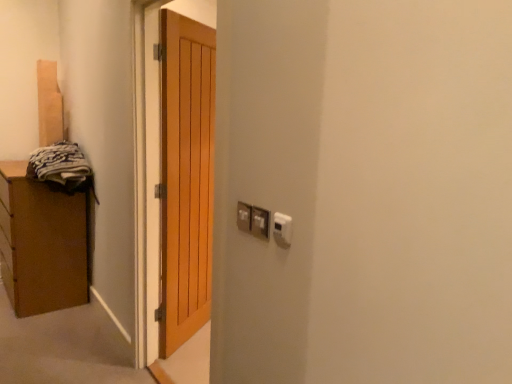
Where is `white plastic electric outlet at center, which is counted as the 3th electric outlet, starting from the front`? The height and width of the screenshot is (384, 512). white plastic electric outlet at center, which is counted as the 3th electric outlet, starting from the front is located at coordinates (x=244, y=216).

How different are the orientations of dark gray fabric at left and light brown wooden door at center in degrees?

The facing directions of dark gray fabric at left and light brown wooden door at center are 122 degrees apart.

Is dark gray fabric at left positioned beyond the bounds of light brown wooden door at center?

Indeed, dark gray fabric at left is completely outside light brown wooden door at center.

Based on the photo, is dark gray fabric at left turned away from light brown wooden door at center?

No, dark gray fabric at left's orientation is not away from light brown wooden door at center.

Between dark gray fabric at left and light brown wooden door at center, which one has less height?

Standing shorter between the two is dark gray fabric at left.

Considering the sizes of objects metallic silver electrical outlet at center-right, which is the 2th electric outlet from back to front, and white plastic thermostat at upper right, which is counted as the third electric outlet, starting from the back, in the image provided, who is wider, metallic silver electrical outlet at center-right, which is the 2th electric outlet from back to front, or white plastic thermostat at upper right, which is counted as the third electric outlet, starting from the back,?

metallic silver electrical outlet at center-right, which is the 2th electric outlet from back to front.

Locate an element on the screen. This screenshot has height=384, width=512. electric outlet that appears below the metallic silver electrical outlet at center-right, which is the 2th electric outlet from back to front (from the image's perspective) is located at coordinates pos(282,229).

Is metallic silver electrical outlet at center-right, positioned as the 2th electric outlet in front-to-back order, bigger or smaller than white plastic thermostat at upper right, which is counted as the third electric outlet, starting from the back?

In the image, metallic silver electrical outlet at center-right, positioned as the 2th electric outlet in front-to-back order, appears to be larger than white plastic thermostat at upper right, which is counted as the third electric outlet, starting from the back.

Is metallic silver electrical outlet at center-right, which is the 2th electric outlet from back to front, aimed at white plastic thermostat at upper right, which is counted as the third electric outlet, starting from the back?

No, metallic silver electrical outlet at center-right, which is the 2th electric outlet from back to front, does not turn towards white plastic thermostat at upper right, which is counted as the third electric outlet, starting from the back.

Is white plastic thermostat at upper right, which is counted as the third electric outlet, starting from the back, taller or shorter than metallic silver electrical outlet at center-right, which is the 2th electric outlet from back to front?

Considering their sizes, white plastic thermostat at upper right, which is counted as the third electric outlet, starting from the back, has more height than metallic silver electrical outlet at center-right, which is the 2th electric outlet from back to front.

From a real-world perspective, which object rests below the other?

From a 3D spatial view, white plastic thermostat at upper right, which is counted as the third electric outlet, starting from the back, is below.

Is white plastic thermostat at upper right, which is counted as the third electric outlet, starting from the back, positioned in front of metallic silver electrical outlet at center-right, which is the 2th electric outlet from back to front?

Yes, it is.

Considering the sizes of objects white plastic thermostat at upper right, marked as the first electric outlet in a front-to-back arrangement, and metallic silver electrical outlet at center-right, which is the 2th electric outlet from back to front, in the image provided, who is smaller, white plastic thermostat at upper right, marked as the first electric outlet in a front-to-back arrangement, or metallic silver electrical outlet at center-right, which is the 2th electric outlet from back to front,?

With smaller size is white plastic thermostat at upper right, marked as the first electric outlet in a front-to-back arrangement.

Is white plastic thermostat at upper right, which is counted as the third electric outlet, starting from the back, located outside dark gray fabric at left?

Indeed, white plastic thermostat at upper right, which is counted as the third electric outlet, starting from the back, is completely outside dark gray fabric at left.

From their relative heights in the image, would you say white plastic thermostat at upper right, marked as the first electric outlet in a front-to-back arrangement, is taller or shorter than dark gray fabric at left?

Clearly, white plastic thermostat at upper right, marked as the first electric outlet in a front-to-back arrangement, is shorter compared to dark gray fabric at left.

From a real-world perspective, is white plastic thermostat at upper right, marked as the first electric outlet in a front-to-back arrangement, positioned over dark gray fabric at left based on gravity?

Indeed, from a real-world perspective, white plastic thermostat at upper right, marked as the first electric outlet in a front-to-back arrangement, stands above dark gray fabric at left.

Consider the image. Could you tell me if white plastic thermostat at upper right, which is counted as the third electric outlet, starting from the back, is facing dark gray fabric at left?

No, white plastic thermostat at upper right, which is counted as the third electric outlet, starting from the back, is not aimed at dark gray fabric at left.

Is dark gray fabric at left taller or shorter than white plastic electric outlet at center, which appears as the first electric outlet when viewed from the back?

dark gray fabric at left is taller than white plastic electric outlet at center, which appears as the first electric outlet when viewed from the back.

From a real-world perspective, is dark gray fabric at left on white plastic electric outlet at center, which appears as the first electric outlet when viewed from the back?

No, from a real-world perspective, dark gray fabric at left is not on top of white plastic electric outlet at center, which appears as the first electric outlet when viewed from the back.

Between dark gray fabric at left and white plastic electric outlet at center, which appears as the first electric outlet when viewed from the back, which one is positioned in front?

white plastic electric outlet at center, which appears as the first electric outlet when viewed from the back, is in front.

Is dark gray fabric at left not close to white plastic electric outlet at center, which appears as the first electric outlet when viewed from the back?

Absolutely, dark gray fabric at left is distant from white plastic electric outlet at center, which appears as the first electric outlet when viewed from the back.

Is white plastic electric outlet at center, which appears as the first electric outlet when viewed from the back, taller or shorter than metallic silver electrical outlet at center-right, which is the 2th electric outlet from back to front?

Considering their sizes, white plastic electric outlet at center, which appears as the first electric outlet when viewed from the back, has less height than metallic silver electrical outlet at center-right, which is the 2th electric outlet from back to front.

Considering the relative positions of white plastic electric outlet at center, which appears as the first electric outlet when viewed from the back, and metallic silver electrical outlet at center-right, positioned as the 2th electric outlet in front-to-back order, in the image provided, is white plastic electric outlet at center, which appears as the first electric outlet when viewed from the back, to the left of metallic silver electrical outlet at center-right, positioned as the 2th electric outlet in front-to-back order, from the viewer's perspective?

Yes.

How many degrees apart are the facing directions of white plastic electric outlet at center, which is counted as the 3th electric outlet, starting from the front, and metallic silver electrical outlet at center-right, positioned as the 2th electric outlet in front-to-back order?

3.08 degrees separate the facing orientations of white plastic electric outlet at center, which is counted as the 3th electric outlet, starting from the front, and metallic silver electrical outlet at center-right, positioned as the 2th electric outlet in front-to-back order.

From the image's perspective, between white plastic electric outlet at center, which is counted as the 3th electric outlet, starting from the front, and metallic silver electrical outlet at center-right, positioned as the 2th electric outlet in front-to-back order, which one is located above?

white plastic electric outlet at center, which is counted as the 3th electric outlet, starting from the front.

Is white plastic electric outlet at center, which appears as the first electric outlet when viewed from the back, turned away from light brown wooden door at center?

No.

From the picture: How many degrees apart are the facing directions of white plastic electric outlet at center, which is counted as the 3th electric outlet, starting from the front, and light brown wooden door at center?

124 degrees.

Considering the positions of objects white plastic electric outlet at center, which appears as the first electric outlet when viewed from the back, and light brown wooden door at center in the image provided, who is more to the left, white plastic electric outlet at center, which appears as the first electric outlet when viewed from the back, or light brown wooden door at center?

light brown wooden door at center is more to the left.

Is white plastic electric outlet at center, which is counted as the 3th electric outlet, starting from the front, next to light brown wooden door at center?

There is a gap between white plastic electric outlet at center, which is counted as the 3th electric outlet, starting from the front, and light brown wooden door at center.

The width and height of the screenshot is (512, 384). I want to click on door that is below the dark gray fabric at left (from the image's perspective), so click(x=186, y=177).

Where is `electric outlet that is the 1st one above the white plastic thermostat at upper right, which is counted as the third electric outlet, starting from the back (from a real-world perspective)`? The image size is (512, 384). electric outlet that is the 1st one above the white plastic thermostat at upper right, which is counted as the third electric outlet, starting from the back (from a real-world perspective) is located at coordinates (260, 222).

Looking at the image, which one is located closer to white plastic electric outlet at center, which is counted as the 3th electric outlet, starting from the front, white plastic thermostat at upper right, marked as the first electric outlet in a front-to-back arrangement, or dark gray fabric at left?

Based on the image, white plastic thermostat at upper right, marked as the first electric outlet in a front-to-back arrangement, appears to be nearer to white plastic electric outlet at center, which is counted as the 3th electric outlet, starting from the front.

Based on their spatial positions, is metallic silver electrical outlet at center-right, positioned as the 2th electric outlet in front-to-back order, or light brown wooden door at center further from white plastic electric outlet at center, which appears as the first electric outlet when viewed from the back?

light brown wooden door at center lies further to white plastic electric outlet at center, which appears as the first electric outlet when viewed from the back, than the other object.

Looking at this image, from the image, which object appears to be farther from metallic silver electrical outlet at center-right, which is the 2th electric outlet from back to front, white plastic electric outlet at center, which appears as the first electric outlet when viewed from the back, or white plastic thermostat at upper right, marked as the first electric outlet in a front-to-back arrangement?

Among the two, white plastic thermostat at upper right, marked as the first electric outlet in a front-to-back arrangement, is located further to metallic silver electrical outlet at center-right, which is the 2th electric outlet from back to front.

From the image, which object appears to be nearer to white plastic electric outlet at center, which appears as the first electric outlet when viewed from the back, metallic silver electrical outlet at center-right, which is the 2th electric outlet from back to front, or white plastic thermostat at upper right, marked as the first electric outlet in a front-to-back arrangement?

metallic silver electrical outlet at center-right, which is the 2th electric outlet from back to front, is positioned closer to the anchor white plastic electric outlet at center, which appears as the first electric outlet when viewed from the back.

From the image, which object appears to be farther from white plastic thermostat at upper right, marked as the first electric outlet in a front-to-back arrangement, light brown wooden door at center or white plastic electric outlet at center, which is counted as the 3th electric outlet, starting from the front?

light brown wooden door at center is positioned further to the anchor white plastic thermostat at upper right, marked as the first electric outlet in a front-to-back arrangement.

Looking at the image, which one is located closer to light brown wooden door at center, white plastic thermostat at upper right, marked as the first electric outlet in a front-to-back arrangement, or dark gray fabric at left?

dark gray fabric at left is positioned closer to the anchor light brown wooden door at center.

Estimate the real-world distances between objects in this image. Which object is further from white plastic thermostat at upper right, marked as the first electric outlet in a front-to-back arrangement, metallic silver electrical outlet at center-right, positioned as the 2th electric outlet in front-to-back order, or white plastic electric outlet at center, which is counted as the 3th electric outlet, starting from the front?

white plastic electric outlet at center, which is counted as the 3th electric outlet, starting from the front, is positioned further to the anchor white plastic thermostat at upper right, marked as the first electric outlet in a front-to-back arrangement.

Estimate the real-world distances between objects in this image. Which object is closer to metallic silver electrical outlet at center-right, which is the 2th electric outlet from back to front, white plastic electric outlet at center, which appears as the first electric outlet when viewed from the back, or dark gray fabric at left?

Based on the image, white plastic electric outlet at center, which appears as the first electric outlet when viewed from the back, appears to be nearer to metallic silver electrical outlet at center-right, which is the 2th electric outlet from back to front.

You are a GUI agent. You are given a task and a screenshot of the screen. Output one action in this format:
    pyautogui.click(x=<x>, y=<y>)
    Task: Click on the electric outlet between metallic silver electrical outlet at center-right, which is the 2th electric outlet from back to front, and light brown wooden door at center in the front-back direction
    This screenshot has width=512, height=384.
    Given the screenshot: What is the action you would take?
    pyautogui.click(x=244, y=216)

At what (x,y) coordinates should I click in order to perform the action: click on electric outlet between dark gray fabric at left and metallic silver electrical outlet at center-right, which is the 2th electric outlet from back to front. Please return your answer as a coordinate pair (x, y). Looking at the image, I should click on (244, 216).

The width and height of the screenshot is (512, 384). What are the coordinates of `door situated between dark gray fabric at left and white plastic electric outlet at center, which appears as the first electric outlet when viewed from the back, from left to right` in the screenshot? It's located at (186, 177).

Where is `door situated between dark gray fabric at left and metallic silver electrical outlet at center-right, which is the 2th electric outlet from back to front, from left to right`? This screenshot has height=384, width=512. door situated between dark gray fabric at left and metallic silver electrical outlet at center-right, which is the 2th electric outlet from back to front, from left to right is located at coordinates (186, 177).